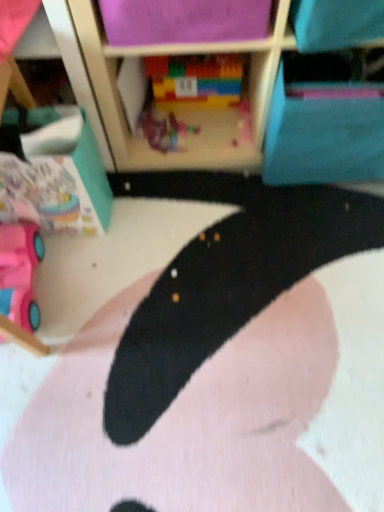
At what (x,y) coordinates should I click in order to perform the action: click on free space that is to the left of blue fabric cabinet at upper right. Please return your answer as a coordinate pair (x, y). This screenshot has height=512, width=384. Looking at the image, I should click on (236, 194).